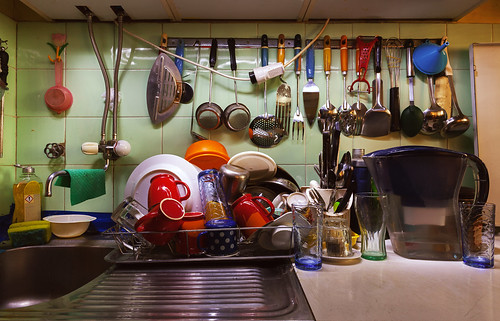
Locate an element on the screen. Image resolution: width=500 pixels, height=321 pixels. spoons is located at coordinates (456, 129), (435, 120), (407, 124), (195, 135), (346, 118), (323, 113).